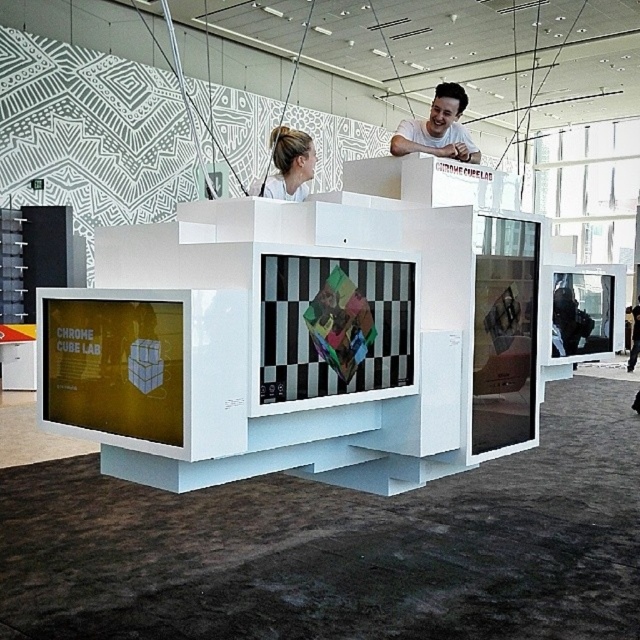
Question: Can you confirm if matte white shirt at upper center is positioned to the left of white matte hair at upper center?

Choices:
 (A) yes
 (B) no

Answer: (B)

Question: Which point is closer to the camera?

Choices:
 (A) white matte hair at upper center
 (B) matte white shirt at upper center

Answer: (A)

Question: Does matte white shirt at upper center appear over white matte hair at upper center?

Choices:
 (A) yes
 (B) no

Answer: (A)

Question: Among these objects, which one is nearest to the camera?

Choices:
 (A) white matte hair at upper center
 (B) matte white shirt at upper center

Answer: (A)

Question: Which point is closer to the camera taking this photo?

Choices:
 (A) (442, 141)
 (B) (275, 186)

Answer: (B)

Question: Is the position of matte white shirt at upper center less distant than that of white matte hair at upper center?

Choices:
 (A) no
 (B) yes

Answer: (A)